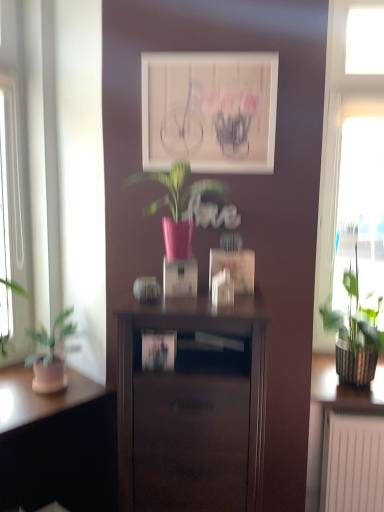
Question: Visually, is transparent glass window at right positioned to the left or to the right of matte white picture frame at center?

Choices:
 (A) right
 (B) left

Answer: (A)

Question: From the image's perspective, is transparent glass window at right located above or below matte white picture frame at center?

Choices:
 (A) below
 (B) above

Answer: (A)

Question: Which is farther from the transparent glass window at right?

Choices:
 (A) matte wood desk at lower left
 (B) dark wood nightstand at center
 (C) pink glossy vase at center, placed as the 1th houseplant when sorted from left to right
 (D) green textured plant at right, which is counted as the 2th houseplant, starting from the left
 (E) matte white picture frame at center

Answer: (A)

Question: Which of these objects is positioned farthest from the matte wood desk at lower left?

Choices:
 (A) matte white picture frame at center
 (B) pink glossy vase at center, the 1th houseplant from the top
 (C) green textured plant at right, which appears as the 1th houseplant when viewed from the back
 (D) transparent glass window at right
 (E) dark wood nightstand at center

Answer: (D)